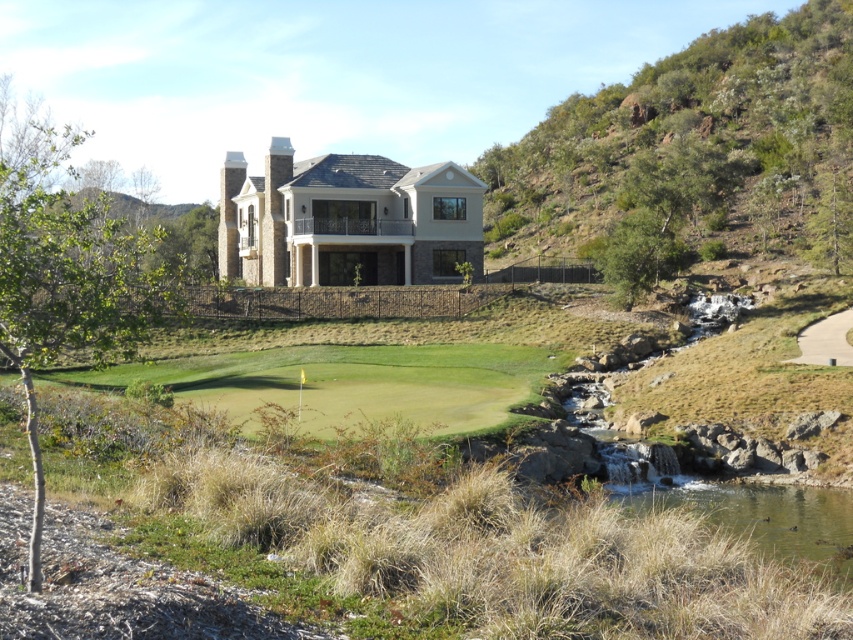
Is green leafy hillside at upper right shorter than beige stone mansion at center?

No, green leafy hillside at upper right is not shorter than beige stone mansion at center.

The width and height of the screenshot is (853, 640). Describe the element at coordinates (695, 150) in the screenshot. I see `green leafy hillside at upper right` at that location.

Find the location of a particular element. green leafy hillside at upper right is located at coordinates (695, 150).

Between point (801, 148) and point (622, 497), which one is positioned in front?

Point (622, 497) is in front.

Which is above, green leafy hillside at upper right or green grassy pond at lower right?

Positioned higher is green leafy hillside at upper right.

The height and width of the screenshot is (640, 853). Identify the location of green leafy hillside at upper right. (695, 150).

Who is taller, beige stone mansion at center or green grassy pond at lower right?

beige stone mansion at center is taller.

Is point (354, 216) behind point (630, 486)?

Yes, it is behind point (630, 486).

Identify the location of beige stone mansion at center. This screenshot has height=640, width=853. [x=346, y=220].